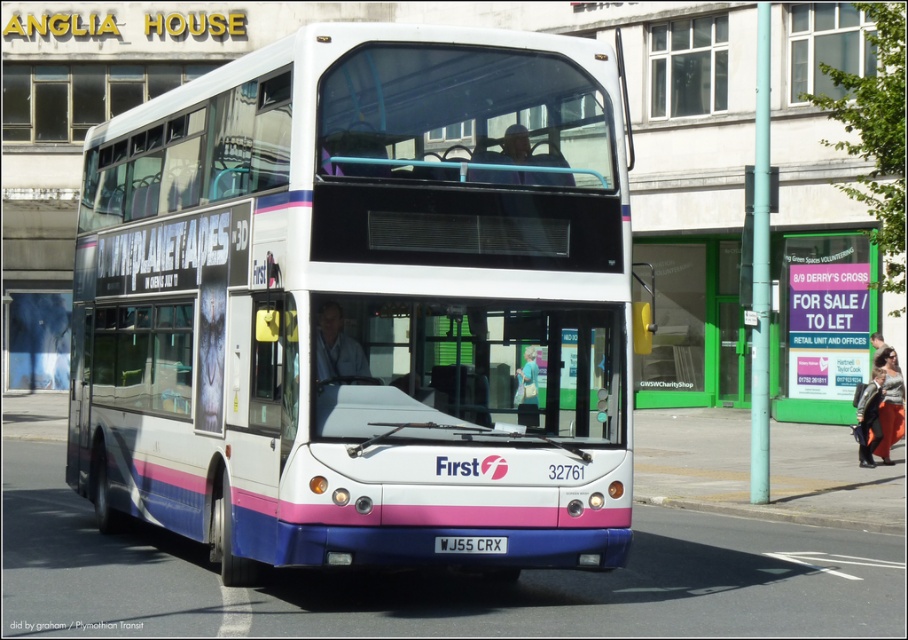
You are a pedestrian standing on the sidewalk looking at the white glossy decker bus at center and the white plastic license plate at center. Which object is positioned more to the left?

The white plastic license plate at center is positioned more to the left than the white glossy decker bus at center.

You are a delivery person trying to park your 1.8 meter wide van between the white glossy decker bus at center and another vehicle. The white plastic license plate at center indicates the minimum width requirement for parking here. Can you safely park your van here?

The white glossy decker bus at center might be wider than the white plastic license plate at center, so there might not be enough space for your van to park safely between them.